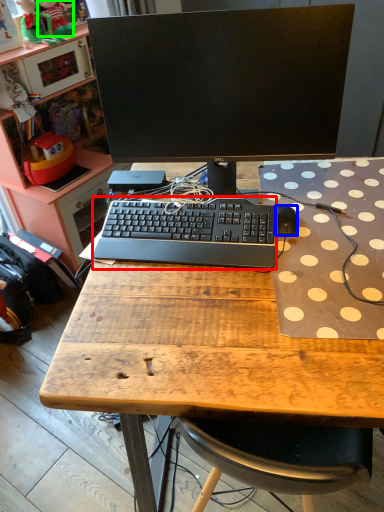
Question: Which is farther away from computer keyboard (highlighted by a red box)? mouse (highlighted by a blue box) or toy (highlighted by a green box)?

Choices:
 (A) mouse
 (B) toy

Answer: (B)